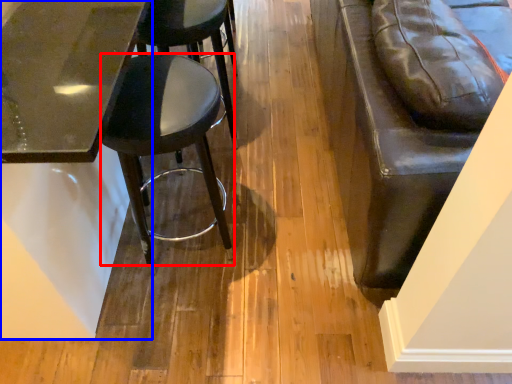
Question: Which object is further to the camera taking this photo, stool (highlighted by a red box) or table (highlighted by a blue box)?

Choices:
 (A) stool
 (B) table

Answer: (A)